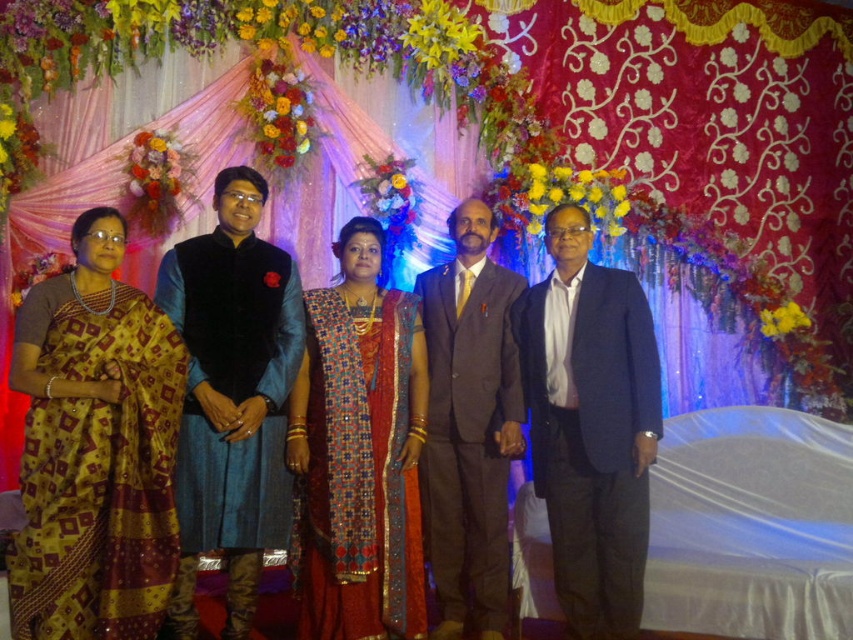
Question: Does yellow silk saree at left appear on the right side of red silk saree at center?

Choices:
 (A) no
 (B) yes

Answer: (A)

Question: Which point appears farthest from the camera in this image?

Choices:
 (A) (566, 369)
 (B) (80, 368)
 (C) (451, 609)
 (D) (236, 637)

Answer: (C)

Question: Which object is positioned closest to the velvet blue kurta at center?

Choices:
 (A) navy blue suit at center
 (B) matte brown suit at center
 (C) yellow silk saree at left

Answer: (C)

Question: Can you confirm if silk saree at center is positioned below red silk saree at center?

Choices:
 (A) yes
 (B) no

Answer: (B)

Question: Estimate the real-world distances between objects in this image. Which object is farther from the navy blue suit at center?

Choices:
 (A) velvet blue kurta at center
 (B) matte brown suit at center
 (C) red silk saree at center
 (D) silk saree at center

Answer: (D)

Question: Observing the image, what is the correct spatial positioning of navy blue suit at center in reference to matte brown suit at center?

Choices:
 (A) left
 (B) right

Answer: (B)